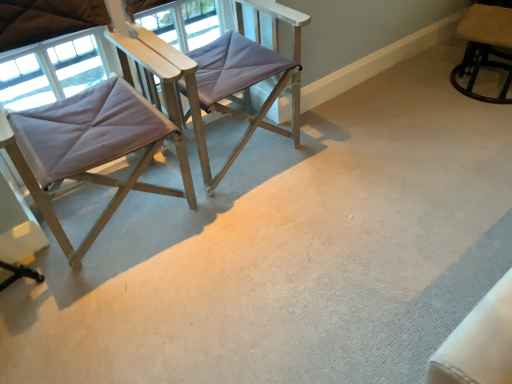
I want to click on vacant space situated on the left part of beige fabric chair at upper right, the first chair when ordered from right to left, so click(x=417, y=96).